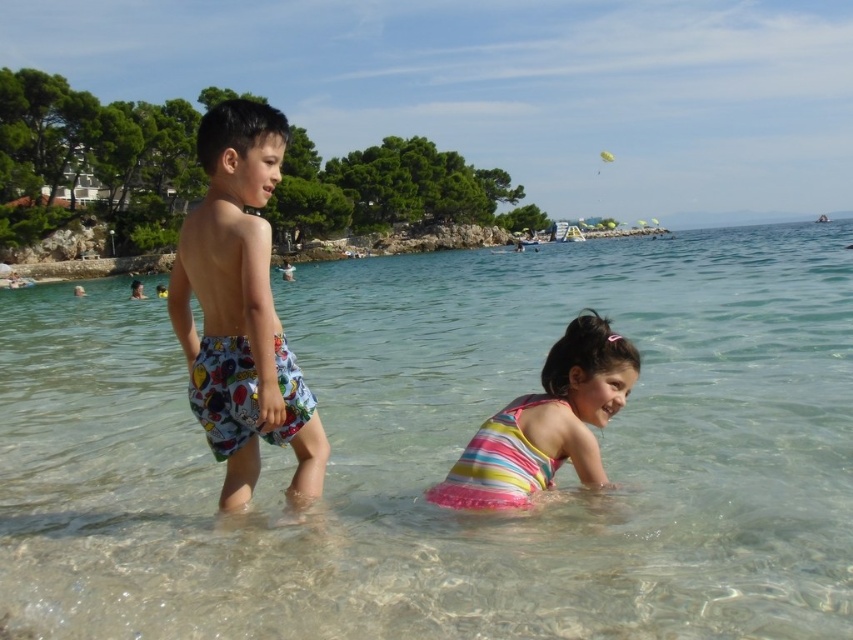
Which is more to the right, printed fabric shorts at left or striped fabric swimsuit at lower center?

striped fabric swimsuit at lower center

Can you confirm if printed fabric shorts at left is positioned below striped fabric swimsuit at lower center?

No, printed fabric shorts at left is not below striped fabric swimsuit at lower center.

Which is behind, point (251, 289) or point (506, 476)?

Point (251, 289)

You are a GUI agent. You are given a task and a screenshot of the screen. Output one action in this format:
    pyautogui.click(x=<x>, y=<y>)
    Task: Click on the printed fabric shorts at left
    This screenshot has height=640, width=853.
    Given the screenshot: What is the action you would take?
    pyautogui.click(x=241, y=308)

Does clear water at center have a greater width compared to printed fabric shorts at left?

Indeed, clear water at center has a greater width compared to printed fabric shorts at left.

Consider the image. Does clear water at center appear on the right side of printed fabric shorts at left?

Yes, clear water at center is to the right of printed fabric shorts at left.

Which is in front, point (766, 326) or point (207, 234)?

Point (207, 234)

Where is `clear water at center`? Image resolution: width=853 pixels, height=640 pixels. clear water at center is located at coordinates (450, 452).

Is clear water at center shorter than striped fabric swimsuit at lower center?

Incorrect, clear water at center's height does not fall short of striped fabric swimsuit at lower center's.

Does clear water at center appear over striped fabric swimsuit at lower center?

Yes, clear water at center is above striped fabric swimsuit at lower center.

The image size is (853, 640). I want to click on clear water at center, so [x=450, y=452].